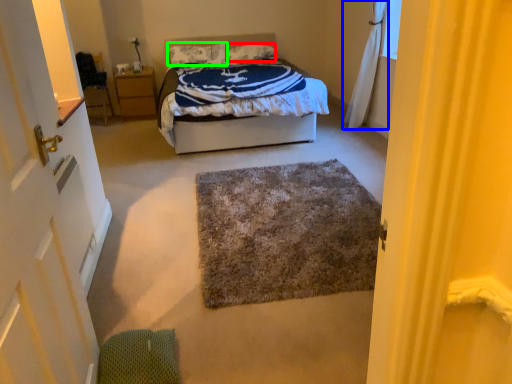
Question: Estimate the real-world distances between objects in this image. Which object is farther from pillow (highlighted by a red box), curtain (highlighted by a blue box) or pillow (highlighted by a green box)?

Choices:
 (A) curtain
 (B) pillow

Answer: (A)